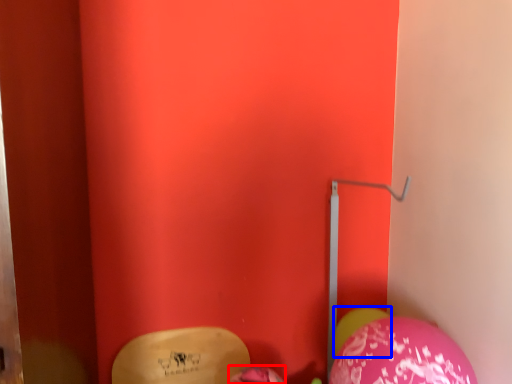
Question: Which object is further to the camera taking this photo, balloon (highlighted by a red box) or balloon (highlighted by a blue box)?

Choices:
 (A) balloon
 (B) balloon

Answer: (B)